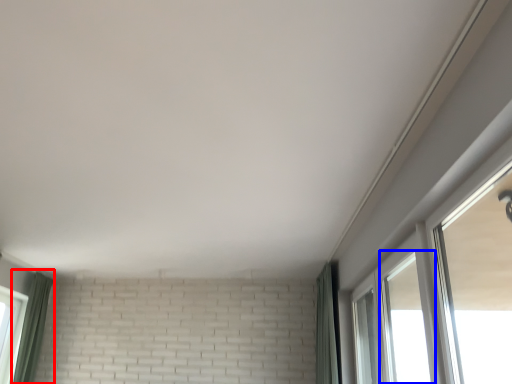
Question: Which object is further to the camera taking this photo, curtain (highlighted by a red box) or window (highlighted by a blue box)?

Choices:
 (A) curtain
 (B) window

Answer: (A)